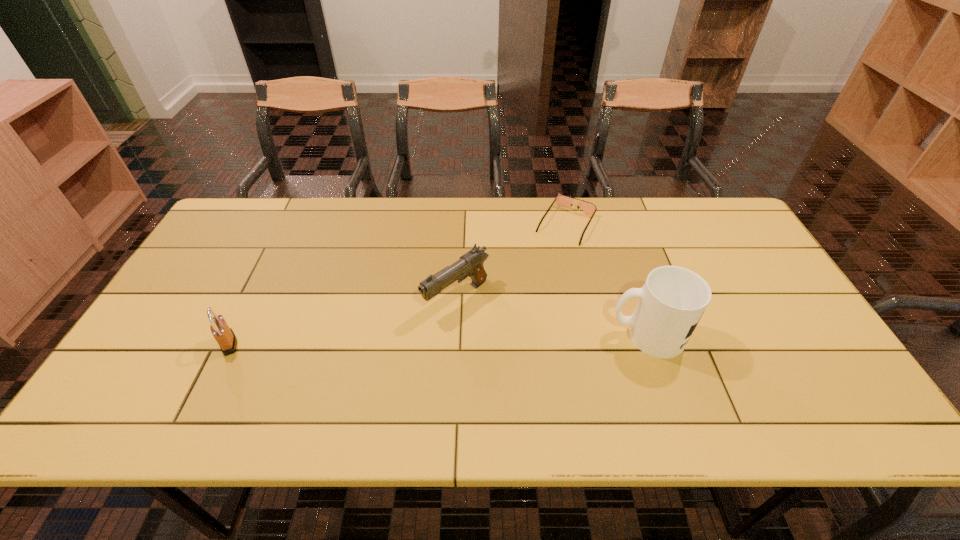
In order to click on blank space located on the bridge of the shortest object in this screenshot , I will do `click(544, 261)`.

Locate an element on the screen. vacant space situated 0.180m on the bridge of the shortest object is located at coordinates (533, 280).

Where is `vacant point located 0.180m in the direction the second object from left to right is aimed`? The image size is (960, 540). vacant point located 0.180m in the direction the second object from left to right is aimed is located at coordinates pos(374,355).

Where is `vacant space located in the direction the second object from left to right is aimed`? vacant space located in the direction the second object from left to right is aimed is located at coordinates (365, 362).

Find the location of a particular element. vacant space situated 0.320m in the direction the second object from left to right is aimed is located at coordinates tap(324, 391).

You are a GUI agent. You are given a task and a screenshot of the screen. Output one action in this format:
    pyautogui.click(x=<x>, y=<y>)
    Task: Click on the object located in the far edge section of the desktop
    The width and height of the screenshot is (960, 540).
    Given the screenshot: What is the action you would take?
    pyautogui.click(x=561, y=200)

This screenshot has height=540, width=960. Identify the location of vacant region at the far edge of the desktop. (603, 238).

Locate an element on the screen. vacant region at the near edge is located at coordinates (336, 360).

Locate an element on the screen. vacant space at the left edge of the desktop is located at coordinates (156, 322).

This screenshot has height=540, width=960. In the image, there is a desktop. What are the coordinates of `vacant space at the right edge` in the screenshot? It's located at (762, 285).